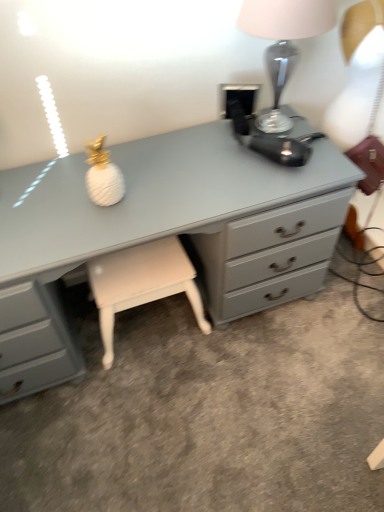
Identify the location of vacant space in front of matte gray chest of drawers at center. (170, 431).